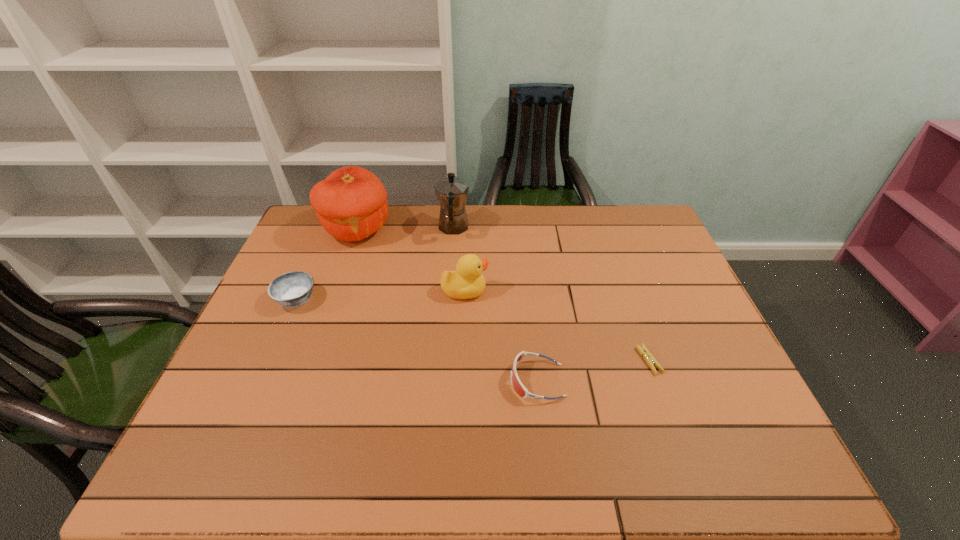
Find the location of a particular element. Image resolution: width=960 pixels, height=540 pixels. pumpkin is located at coordinates (351, 204).

The height and width of the screenshot is (540, 960). Identify the location of coffeepot. (452, 192).

Identify the location of duck. The height and width of the screenshot is (540, 960). (467, 282).

Where is `ashtray`? The height and width of the screenshot is (540, 960). ashtray is located at coordinates (292, 289).

You are a GUI agent. You are given a task and a screenshot of the screen. Output one action in this format:
    pyautogui.click(x=<x>, y=<y>)
    Task: Click on the second object from right to left
    
    Given the screenshot: What is the action you would take?
    pyautogui.click(x=520, y=389)

You are a GUI agent. You are given a task and a screenshot of the screen. Output one action in this format:
    pyautogui.click(x=<x>, y=<y>)
    Task: Click on the shortest object
    The image size is (960, 540).
    Given the screenshot: What is the action you would take?
    pyautogui.click(x=648, y=357)

Locate an element on the screen. The height and width of the screenshot is (540, 960). clothespin is located at coordinates (648, 357).

Locate an element on the screen. Image resolution: width=960 pixels, height=540 pixels. free space located 0.090m on the front of the pumpkin is located at coordinates (343, 269).

This screenshot has width=960, height=540. In order to click on vacant space located 0.190m at the beak of the third tallest object in this screenshot , I will do pos(554,291).

Image resolution: width=960 pixels, height=540 pixels. I want to click on vacant space located 0.370m on the front of the ashtray, so click(233, 443).